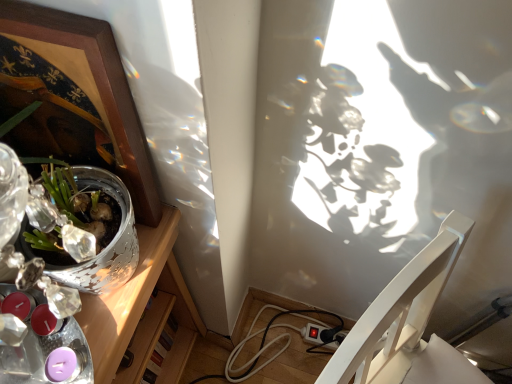
Question: Considering the positions of white glossy chair at lower right and wooden picture frame at upper left in the image, is white glossy chair at lower right wider or thinner than wooden picture frame at upper left?

Choices:
 (A) thin
 (B) wide

Answer: (B)

Question: Does point (409, 380) appear closer or farther from the camera than point (93, 52)?

Choices:
 (A) closer
 (B) farther

Answer: (B)

Question: Which is nearer to the white glossy chair at lower right?

Choices:
 (A) wooden picture frame at upper left
 (B) silver metallic pot at left

Answer: (B)

Question: Which of these objects is positioned farthest from the wooden picture frame at upper left?

Choices:
 (A) white glossy chair at lower right
 (B) silver metallic pot at left

Answer: (A)